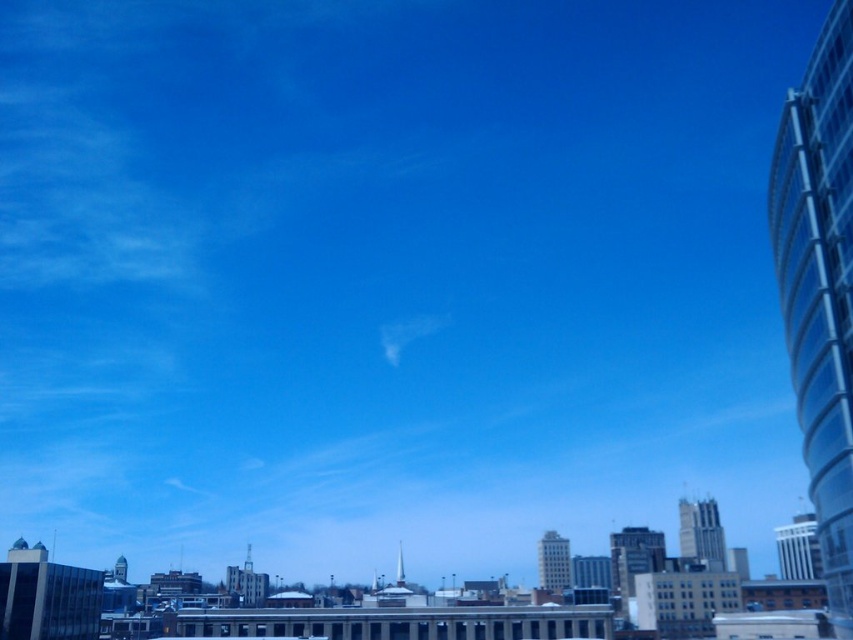
Question: Estimate the real-world distances between objects in this image. Which object is closer to the smooth glass skyscraper at center?

Choices:
 (A) gray concrete tower at lower center
 (B) dark gray glass building at center
 (C) gray concrete skyscraper at center

Answer: (B)

Question: Is smooth glass skyscraper at center smaller than white glass tower at right?

Choices:
 (A) no
 (B) yes

Answer: (B)

Question: Can you confirm if transparent glass tower at right is positioned below smooth glass skyscraper at center?

Choices:
 (A) no
 (B) yes

Answer: (A)

Question: Is transparent glass tower at right below white glass tower at right?

Choices:
 (A) yes
 (B) no

Answer: (B)

Question: Among these objects, which one is farthest from the camera?

Choices:
 (A) white glass tower at right
 (B) transparent glass tower at right
 (C) gray concrete skyscraper at center

Answer: (A)

Question: Which point appears farthest from the camera in this image?

Choices:
 (A) (242, 563)
 (B) (807, 547)
 (C) (715, 518)

Answer: (A)